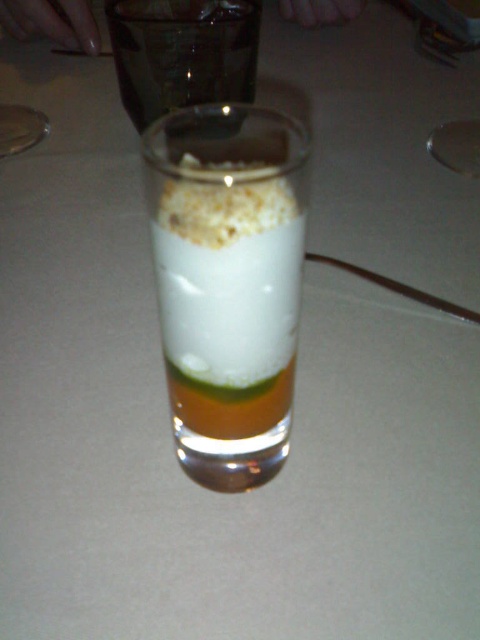
You are a food stylist arranging a dessert display. You have a translucent glass dessert at center and a white crumbly topping at center. If you want to ensure the dessert looks balanced, which item should you place higher in the arrangement?

The translucent glass dessert at center has a greater height compared to the white crumbly topping at center, so to maintain balance, the taller translucent glass dessert at center should be placed higher in the arrangement.

You are holding a spoon and want to reach the bottom layer of the layered dessert in the glass. Which point, point (135, 100) or point (200, 179), is closer to the bottom of the glass?

Point (135, 100) is behind point (200, 179), so it is closer to the bottom of the glass.